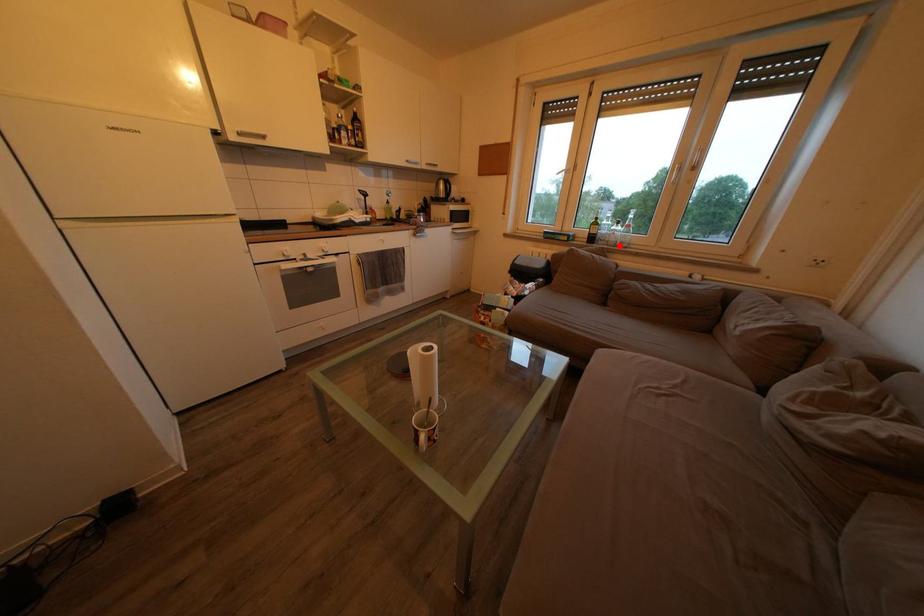
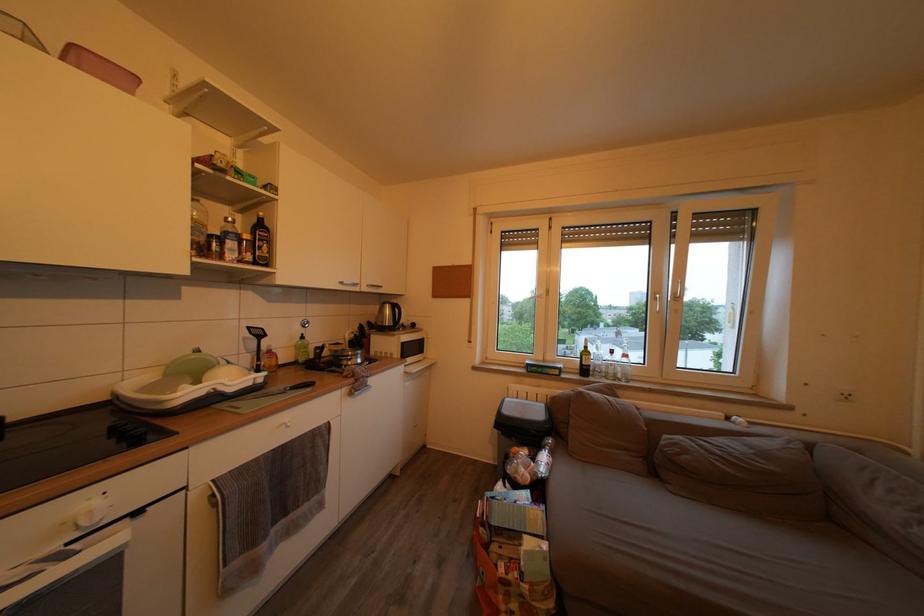
Locate, in the second image, the point that corresponds to the highlighted location in the first image.

(618, 378)